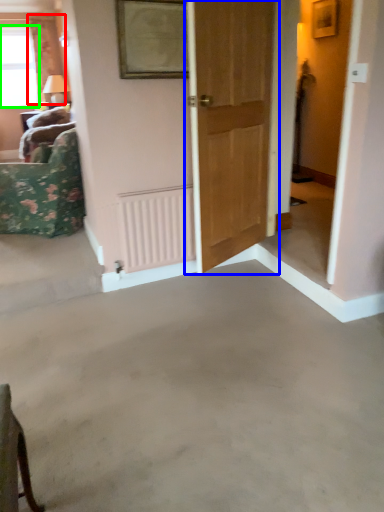
Question: Estimate the real-world distances between objects in this image. Which object is closer to curtain (highlighted by a red box), door (highlighted by a blue box) or window (highlighted by a green box)?

Choices:
 (A) door
 (B) window

Answer: (B)